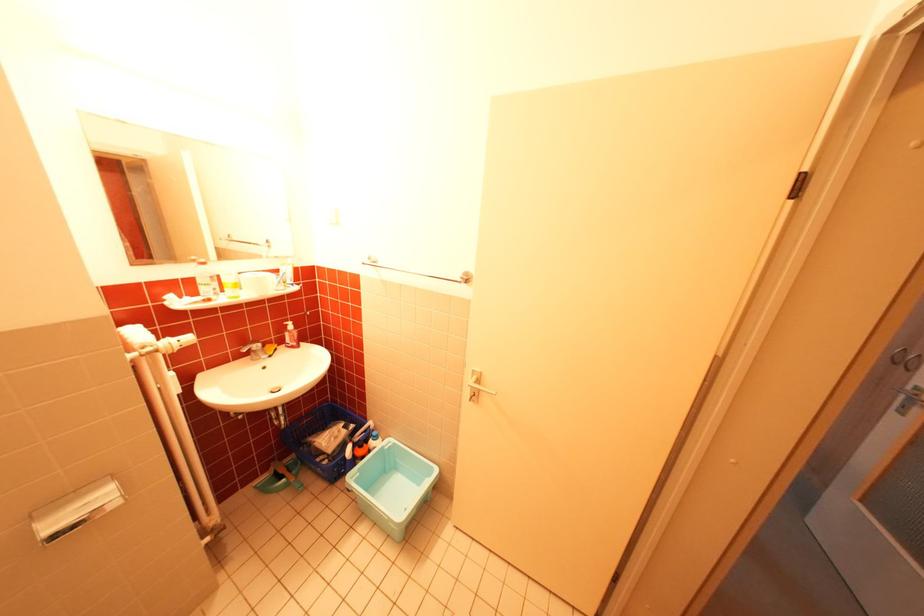
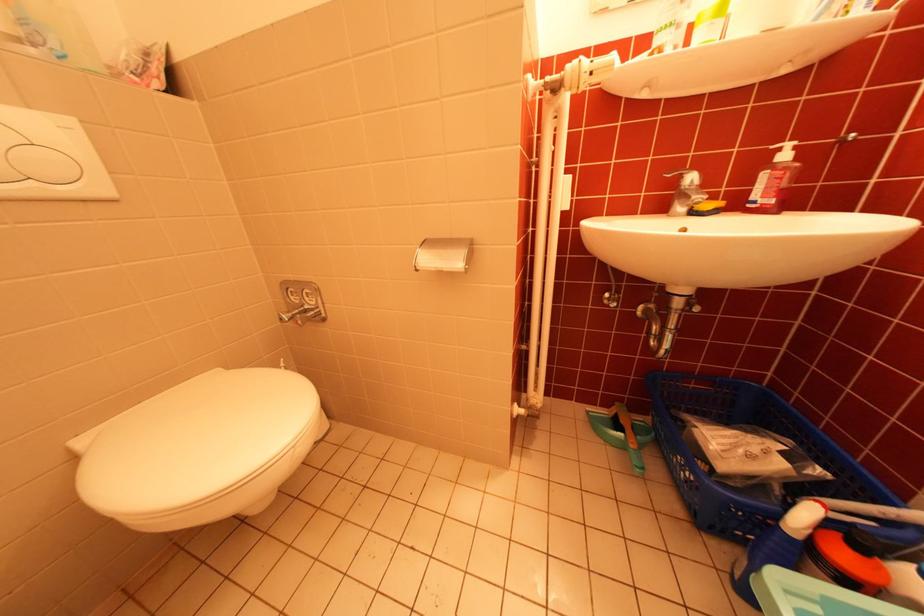
Question: The first image is from the beginning of the video and the second image is from the end. How did the camera likely rotate when shooting the video?

Choices:
 (A) Left
 (B) Right
 (C) Up
 (D) Down

Answer: (A)